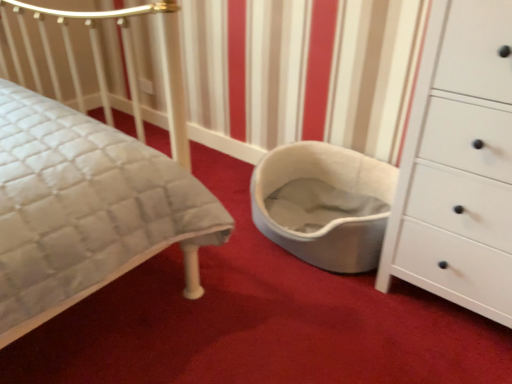
At what (x,y) coordinates should I click in order to perform the action: click on soft gray fabric pet bed at center. Please return your answer as a coordinate pair (x, y). This screenshot has width=512, height=384. Looking at the image, I should click on (333, 185).

What is the approximate height of soft gray fabric pet bed at center?

The height of soft gray fabric pet bed at center is 12.09 inches.

What do you see at coordinates (333, 185) in the screenshot?
I see `soft gray fabric pet bed at center` at bounding box center [333, 185].

You are a GUI agent. You are given a task and a screenshot of the screen. Output one action in this format:
    pyautogui.click(x=<x>, y=<y>)
    Task: Click on the soft gray fabric pet bed at center
    This screenshot has width=512, height=384.
    Given the screenshot: What is the action you would take?
    coord(333,185)